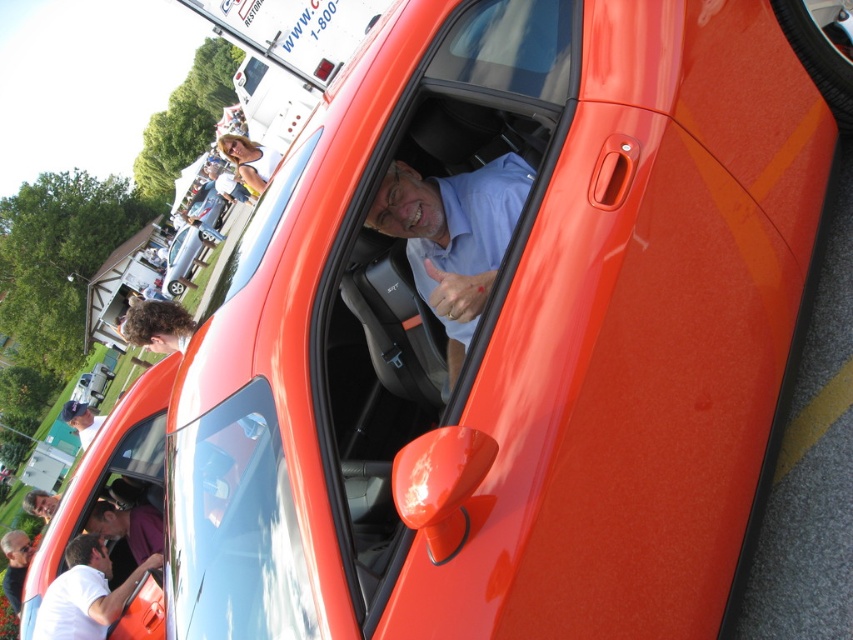
Can you confirm if white matte shirt at lower left is positioned above purple fabric shirt at center?

Actually, white matte shirt at lower left is below purple fabric shirt at center.

Measure the distance between white matte shirt at lower left and purple fabric shirt at center.

white matte shirt at lower left is 59.78 centimeters away from purple fabric shirt at center.

Does point (65, 637) come closer to viewer compared to point (134, 525)?

That is True.

At what (x,y) coordinates should I click in order to perform the action: click on white matte shirt at lower left. Please return your answer as a coordinate pair (x, y). Looking at the image, I should click on (85, 593).

Does point (4, 554) come closer to viewer compared to point (82, 408)?

That is True.

Who is more distant from viewer, [1,547] or [86,422]?

The point [86,422] is behind.

Does point (16, 611) come behind point (65, 412)?

No.

Where is `matte black shirt at lower left`? Image resolution: width=853 pixels, height=640 pixels. matte black shirt at lower left is located at coordinates (15, 564).

Is matte blue shirt at center to the right of purple fabric shirt at center from the viewer's perspective?

Yes, matte blue shirt at center is to the right of purple fabric shirt at center.

Which is behind, point (422, 241) or point (138, 545)?

The point (138, 545) is more distant.

Does point (456, 173) lie in front of point (161, 536)?

Yes, point (456, 173) is closer to viewer.

This screenshot has height=640, width=853. Identify the location of matte blue shirt at center. (453, 236).